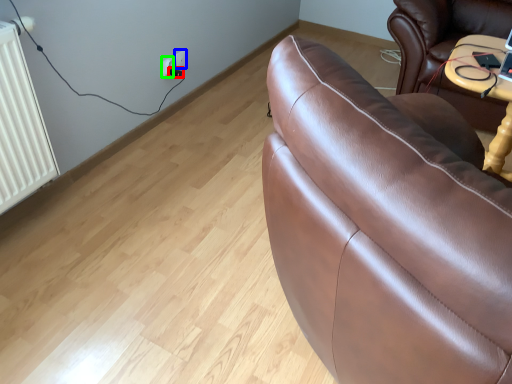
Question: Which is farther away from plug (highlighted by a red box)? electric outlet (highlighted by a blue box) or electric outlet (highlighted by a green box)?

Choices:
 (A) electric outlet
 (B) electric outlet

Answer: (B)